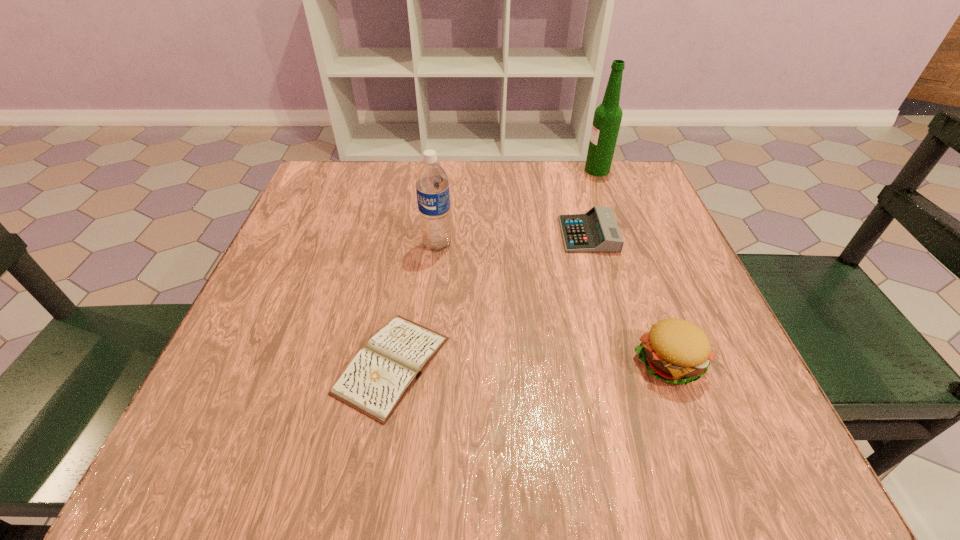
Where is `free space at the near edge`? This screenshot has width=960, height=540. free space at the near edge is located at coordinates (513, 449).

Where is `vacant space at the left edge of the desktop`? vacant space at the left edge of the desktop is located at coordinates (304, 408).

Find the location of a particular element. This screenshot has height=540, width=960. vacant region at the right edge of the desktop is located at coordinates (665, 268).

Find the location of a particular element. The height and width of the screenshot is (540, 960). vacant region at the far left corner of the desktop is located at coordinates (339, 166).

Find the location of `free spot at the far right corner of the desktop`. free spot at the far right corner of the desktop is located at coordinates (642, 200).

What are the coordinates of `unoccupied area between the shortest object and the calculator` in the screenshot? It's located at (490, 300).

What are the coordinates of `free space that is in between the third shortest object and the diary` in the screenshot? It's located at (531, 363).

Locate an element on the screen. The width and height of the screenshot is (960, 540). free space between the farthest object and the second tallest object is located at coordinates (517, 207).

Find the location of a particular element. vacant space in between the fourth shortest object and the diary is located at coordinates (415, 305).

Locate an element on the screen. The height and width of the screenshot is (540, 960). empty space between the diary and the third shortest object is located at coordinates (531, 363).